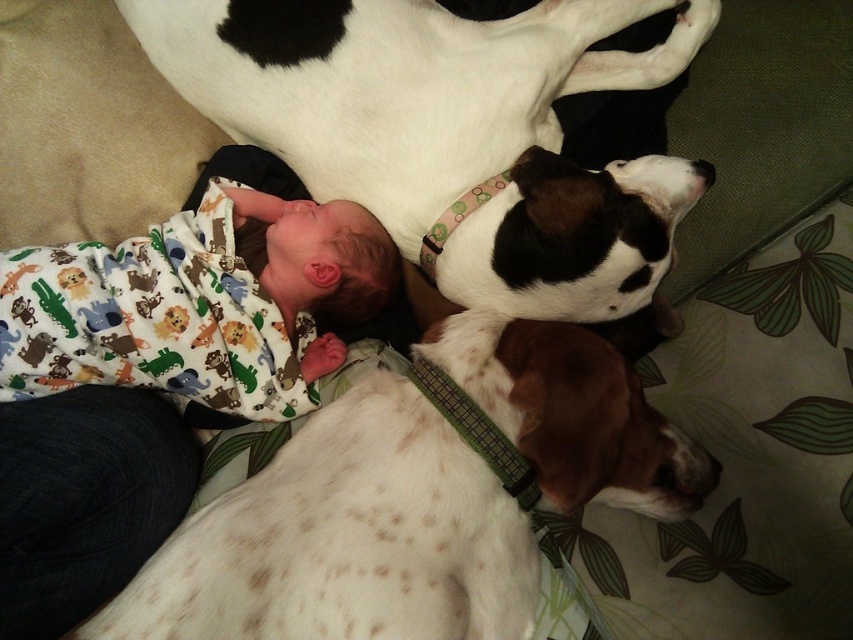
Question: Which point is closer to the camera?

Choices:
 (A) speckled white dog at lower left
 (B) printed flannel baby at center
 (C) white speckled fur at upper center

Answer: (A)

Question: Which object appears closest to the camera in this image?

Choices:
 (A) white speckled fur at upper center
 (B) speckled white dog at lower left

Answer: (B)

Question: Which is farther from the speckled white dog at lower left?

Choices:
 (A) white speckled fur at upper center
 (B) printed flannel baby at center

Answer: (B)

Question: Is white speckled fur at upper center wider than speckled white dog at lower left?

Choices:
 (A) no
 (B) yes

Answer: (B)

Question: Does speckled white dog at lower left appear under printed flannel baby at center?

Choices:
 (A) yes
 (B) no

Answer: (A)

Question: Can you confirm if white speckled fur at upper center is wider than printed flannel baby at center?

Choices:
 (A) yes
 (B) no

Answer: (A)